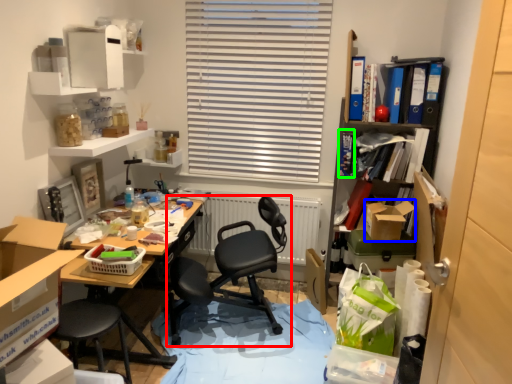
Question: Which object is positioned farthest from chair (highlighted by a red box)? Select from box (highlighted by a blue box) and book (highlighted by a green box).

Choices:
 (A) box
 (B) book

Answer: (B)